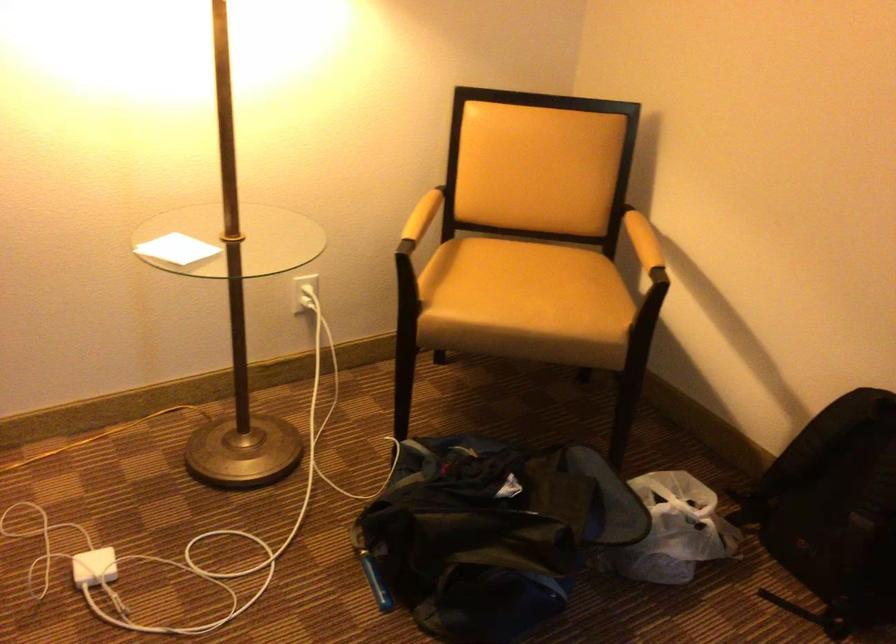
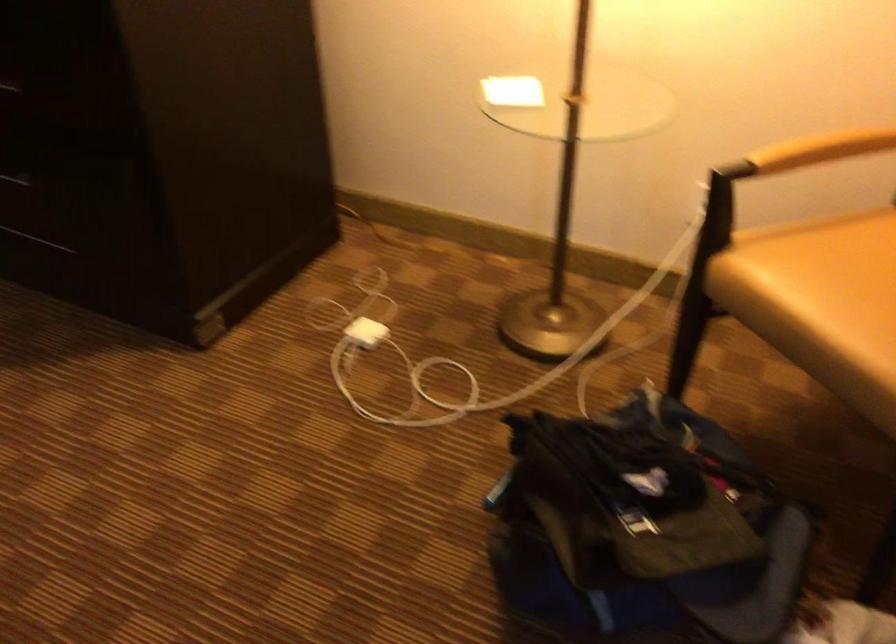
Where in the second image is the point corresponding to (183,245) from the first image?

(513, 91)